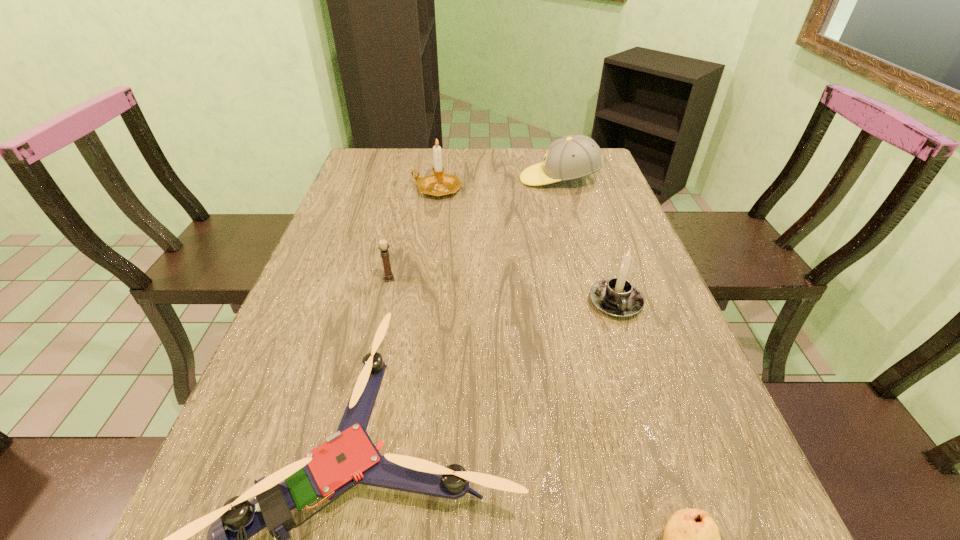
I want to click on vacant space located on the front-facing side of the baseball cap, so click(x=458, y=179).

Find the location of a particular element. Image resolution: width=960 pixels, height=540 pixels. vacant space positioned on the left of the fourth nearest object is located at coordinates (354, 278).

Find the location of a particular element. candle holder located in the far edge section of the desktop is located at coordinates (439, 184).

Where is `baseball cap that is at the far edge`? baseball cap that is at the far edge is located at coordinates (571, 157).

Where is `candle holder at the right edge`? The image size is (960, 540). candle holder at the right edge is located at coordinates pyautogui.click(x=617, y=297).

The height and width of the screenshot is (540, 960). I want to click on baseball cap that is positioned at the right edge, so click(571, 157).

Identify the location of object that is positioned at the far right corner. Image resolution: width=960 pixels, height=540 pixels. (571, 157).

In the image, there is a desktop. Find the location of `vacant space at the far edge`. vacant space at the far edge is located at coordinates (458, 167).

This screenshot has width=960, height=540. In order to click on vacant space at the left edge of the desktop in this screenshot , I will do `click(364, 220)`.

The width and height of the screenshot is (960, 540). Find the location of `free space at the right edge of the desktop`. free space at the right edge of the desktop is located at coordinates (684, 388).